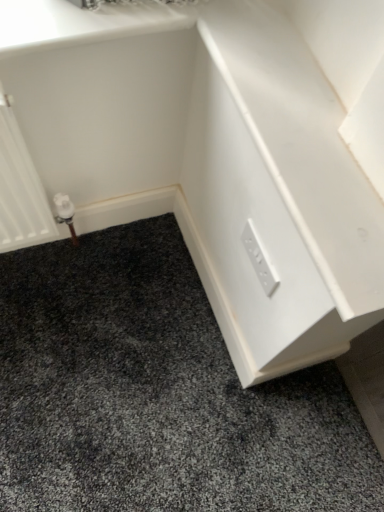
You are a GUI agent. You are given a task and a screenshot of the screen. Output one action in this format:
    pyautogui.click(x=<x>, y=<y>)
    Task: Click on the white plastic electrical outlet at lower right
    The height and width of the screenshot is (512, 384).
    Given the screenshot: What is the action you would take?
    pyautogui.click(x=259, y=259)

This screenshot has width=384, height=512. Describe the element at coordinates (259, 259) in the screenshot. I see `white plastic electrical outlet at lower right` at that location.

Measure the distance between white plastic electrical outlet at lower right and camera.

white plastic electrical outlet at lower right is 32.82 inches away from camera.

You are a GUI agent. You are given a task and a screenshot of the screen. Output one action in this format:
    pyautogui.click(x=<x>, y=<y>)
    Task: Click on the white plastic electrical outlet at lower right
    This screenshot has width=384, height=512.
    Given the screenshot: What is the action you would take?
    pyautogui.click(x=259, y=259)